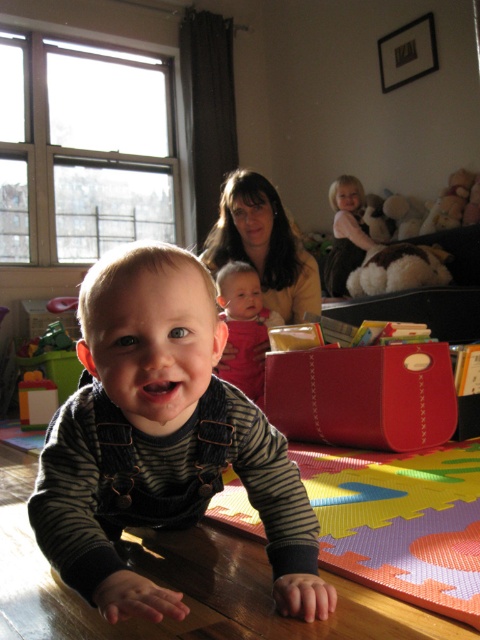
Who is positioned more to the left, striped denim overalls at center or matte yellow sweater at upper center?

From the viewer's perspective, striped denim overalls at center appears more on the left side.

Can you confirm if striped denim overalls at center is smaller than matte yellow sweater at upper center?

Yes.

Describe the element at coordinates (162, 440) in the screenshot. I see `striped denim overalls at center` at that location.

Where is `striped denim overalls at center`? Image resolution: width=480 pixels, height=640 pixels. striped denim overalls at center is located at coordinates (162, 440).

Is point (257, 528) farther from camera compared to point (277, 314)?

No, it is not.

The width and height of the screenshot is (480, 640). What are the coordinates of `multicolored foam puzzle mat at lower center` in the screenshot? It's located at (400, 522).

Does striped denim overalls at center come behind multicolored foam puzzle mat at lower center?

No, it is not.

Is point (183, 481) farther from viewer compared to point (408, 579)?

Yes, it is behind point (408, 579).

Between point (299, 554) and point (395, 508), which one is positioned behind?

The point (395, 508) is behind.

Identify the location of striped denim overalls at center. (162, 440).